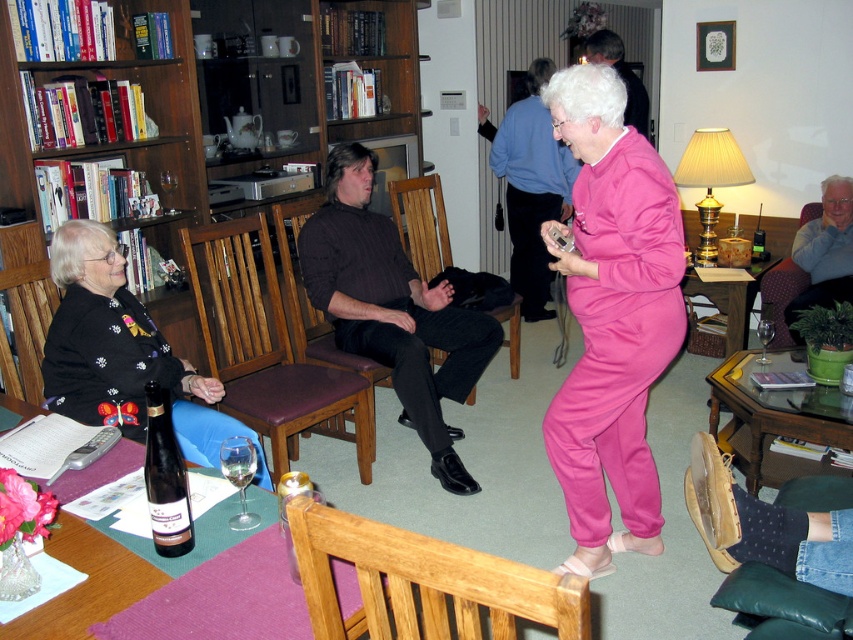
Question: Observing the image, what is the correct spatial positioning of wooden bookshelf at upper left in reference to clear glass wine at lower left?

Choices:
 (A) left
 (B) right

Answer: (A)

Question: Among these objects, which one is farthest from the camera?

Choices:
 (A) wooden chair at center
 (B) gray wool sweater at upper right
 (C) pink fleece at center

Answer: (C)

Question: Is wooden table at lower left smaller than wooden chair at center?

Choices:
 (A) yes
 (B) no

Answer: (A)

Question: Which of the following is the closest to the observer?

Choices:
 (A) transparent glass wine glass at lower center
 (B) wooden table at lower left
 (C) glassmaterial/texturetable at lower center

Answer: (B)

Question: Where is wooden bookshelf at upper left located in relation to wooden table at lower left in the image?

Choices:
 (A) left
 (B) right

Answer: (A)

Question: Among these points, which one is nearest to the camera?

Choices:
 (A) click(x=422, y=344)
 (B) click(x=809, y=264)
 (C) click(x=184, y=477)

Answer: (C)